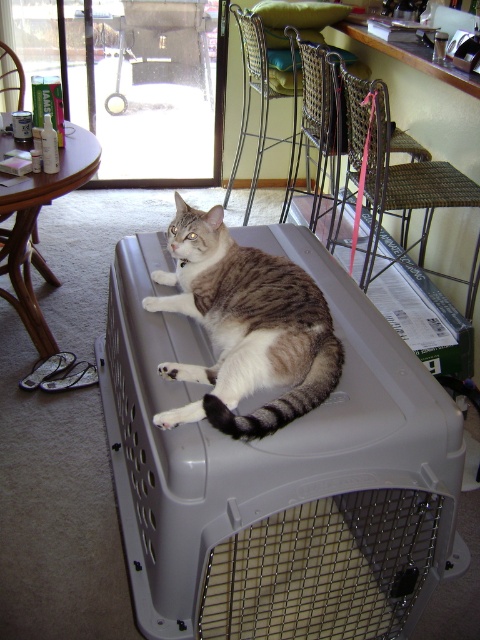
Which is behind, point (332, 611) or point (250, 208)?

The point (250, 208) is more distant.

Who is shorter, gray plastic crate at center or woven metal chair at upper center?

Standing shorter between the two is gray plastic crate at center.

Where is `gray plastic crate at center`? gray plastic crate at center is located at coordinates (277, 474).

Who is higher up, gray plastic crate at center or metallic wire chair at upper center?

metallic wire chair at upper center is higher up.

Based on the photo, measure the distance from gray plastic crate at center to metallic wire chair at upper center.

gray plastic crate at center and metallic wire chair at upper center are 1.44 meters apart from each other.

Does point (194, 340) come behind point (330, 88)?

That is False.

Where is `gray plastic crate at center`? The image size is (480, 640). gray plastic crate at center is located at coordinates point(277,474).

Can you confirm if tabby fur cat at center is bigger than metallic wire chair at upper center?

Incorrect, tabby fur cat at center is not larger than metallic wire chair at upper center.

This screenshot has height=640, width=480. Describe the element at coordinates (245, 326) in the screenshot. I see `tabby fur cat at center` at that location.

Which is in front, point (285, 410) or point (319, 164)?

Point (285, 410) is more forward.

This screenshot has height=640, width=480. In order to click on tabby fur cat at center in this screenshot , I will do `click(245, 326)`.